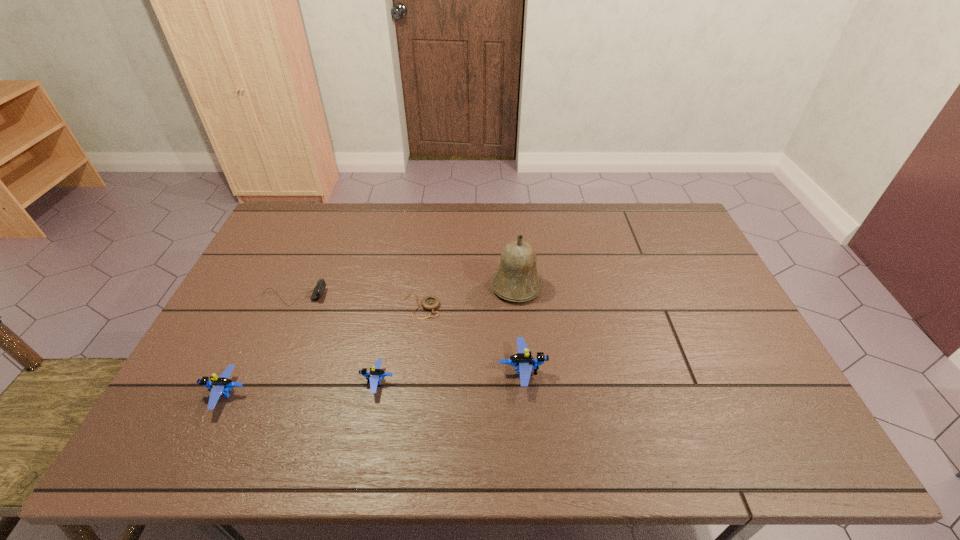
Where is `vacant area that lies between the webcam and the tallest object`? The image size is (960, 540). vacant area that lies between the webcam and the tallest object is located at coordinates point(405,292).

The height and width of the screenshot is (540, 960). I want to click on free point between the pocket watch and the tallest Lego, so click(471, 339).

The height and width of the screenshot is (540, 960). Identify the location of vacant area that lies between the leftmost Lego and the second shortest object. (259, 346).

Identify the location of empty location between the leftmost Lego and the fourth tallest object. (301, 388).

Image resolution: width=960 pixels, height=540 pixels. I want to click on vacant area between the fourth tallest object and the shortest object, so click(x=399, y=344).

Where is `the closest object to the bell`? the closest object to the bell is located at coordinates (429, 303).

This screenshot has width=960, height=540. What are the coordinates of `the closest object to the second Lego from right to left` in the screenshot? It's located at (429, 303).

The height and width of the screenshot is (540, 960). I want to click on the second closest Lego to the tallest object, so click(x=375, y=375).

Locate an element on the screen. Lego that is the second closest to the rightmost Lego is located at coordinates (219, 386).

You are a GUI agent. You are given a task and a screenshot of the screen. Output one action in this format:
    pyautogui.click(x=<x>, y=<y>)
    Task: Click on the free location that satisfies the following two spatial constraints: 1. on the front-facing side of the webcam; 2. on the right side of the shortest object
    
    Given the screenshot: What is the action you would take?
    click(289, 306)